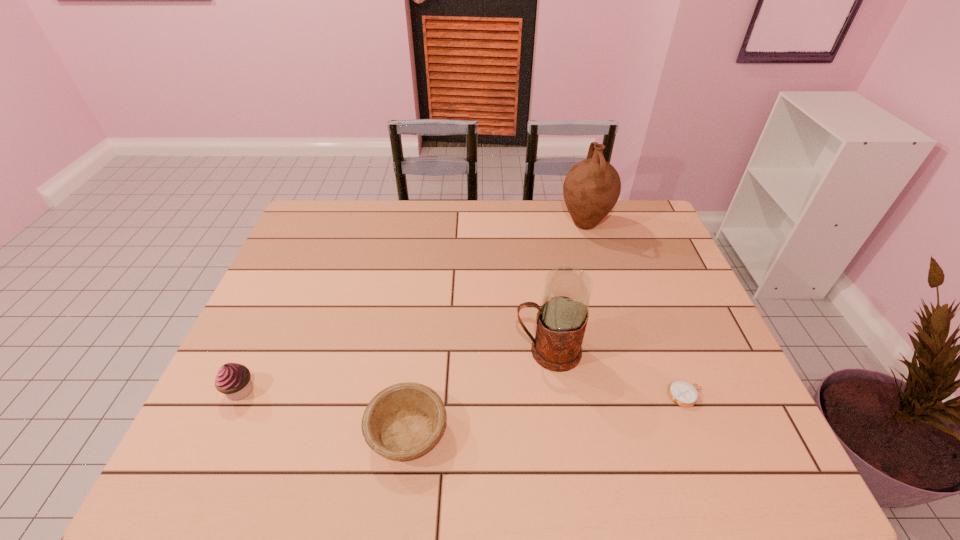
At what (x,y) coordinates should I click in order to perform the action: click on free space located 0.350m with the handle on the side of the second tallest object. Please return your answer as a coordinate pair (x, y). The height and width of the screenshot is (540, 960). Looking at the image, I should click on (376, 351).

Find the location of a particular element. This screenshot has height=540, width=960. free spot located with the handle on the side of the second tallest object is located at coordinates (467, 351).

The height and width of the screenshot is (540, 960). I want to click on vacant area situated 0.390m with the handle on the side of the second tallest object, so click(361, 351).

Identify the location of vacant space situated 0.080m on the back of the third tallest object. (258, 350).

The width and height of the screenshot is (960, 540). Identify the location of vacant region located 0.170m on the left of the fourth object from right to left. (289, 431).

Locate an element on the screen. vacant space located 0.080m on the right of the compass is located at coordinates (738, 395).

Where is `object that is positioned at the far edge`? The image size is (960, 540). object that is positioned at the far edge is located at coordinates (591, 189).

This screenshot has width=960, height=540. Identify the location of object that is at the near edge. (403, 421).

Identify the location of object that is at the left edge. The width and height of the screenshot is (960, 540). (234, 380).

You are a GUI agent. You are given a task and a screenshot of the screen. Output one action in this format:
    pyautogui.click(x=<x>, y=<y>)
    Task: Click on the pitcher that is at the right edge
    The width and height of the screenshot is (960, 540).
    Given the screenshot: What is the action you would take?
    pyautogui.click(x=591, y=189)